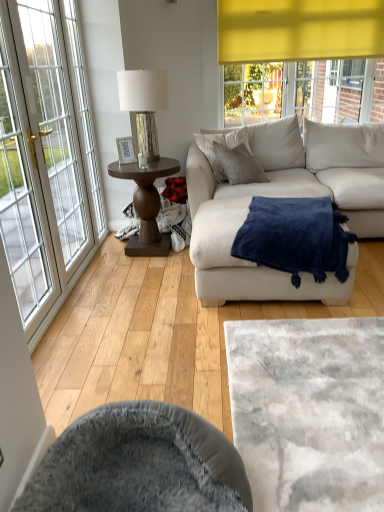
Locate an element on the screen. free space in front of dark brown wood side table at center left is located at coordinates (143, 277).